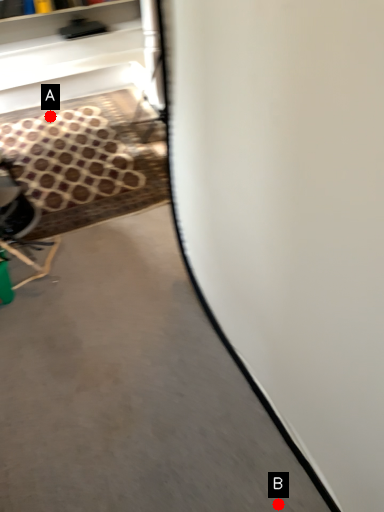
Question: Two points are circled on the image, labeled by A and B beside each circle. Which of the following is the farthest from the observer?

Choices:
 (A) A is further
 (B) B is further

Answer: (A)